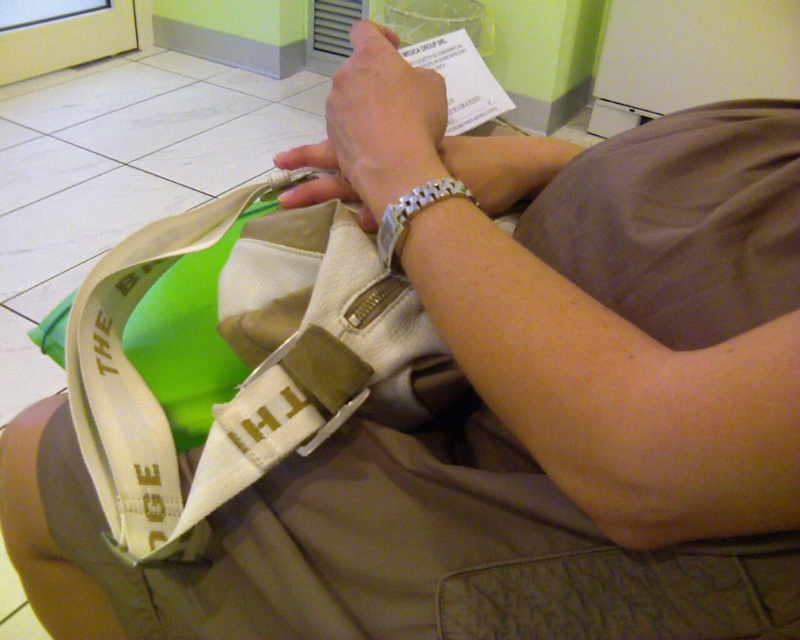
Is point (694, 602) positioned in front of point (396, 230)?

Yes.

Does textured olive-green pocket at lower center appear on the right side of silver metallic bracelet at upper center?

Indeed, textured olive-green pocket at lower center is positioned on the right side of silver metallic bracelet at upper center.

Does point (556, 614) come behind point (432, 202)?

No.

Locate an element on the screen. Image resolution: width=800 pixels, height=640 pixels. textured olive-green pocket at lower center is located at coordinates (630, 595).

Is textured olive-green pocket at lower center closer to the viewer compared to silver metallic watch at upper center?

That is True.

Image resolution: width=800 pixels, height=640 pixels. Find the location of `textured olive-green pocket at lower center`. textured olive-green pocket at lower center is located at coordinates (630, 595).

Is point (334, 128) closer to viewer compared to point (397, 214)?

No.

Is silver metallic watch at upper center smaller than silver metallic bracelet at upper center?

No, silver metallic watch at upper center is not smaller than silver metallic bracelet at upper center.

Who is more forward, (372,195) or (404,225)?

Point (404,225) is more forward.

Find the location of `silver metallic watch at upper center`. silver metallic watch at upper center is located at coordinates (382, 124).